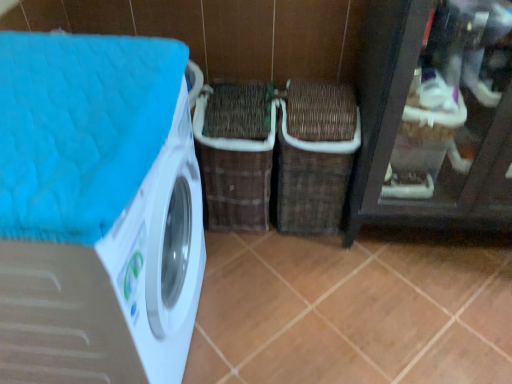
Image resolution: width=512 pixels, height=384 pixels. I want to click on free space on the front side of woven brown basket at center, positioned as the 1th basket in right-to-left order, so click(x=314, y=263).